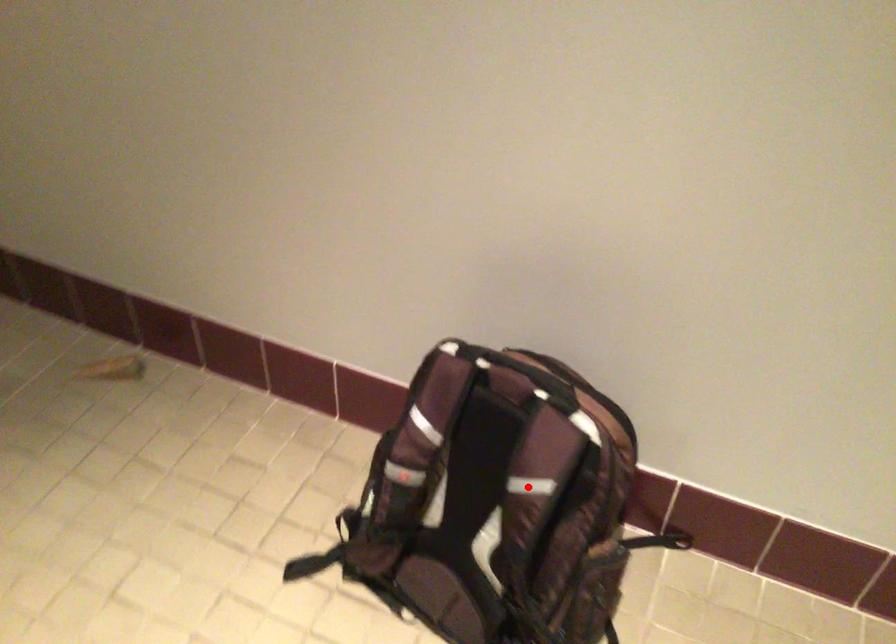
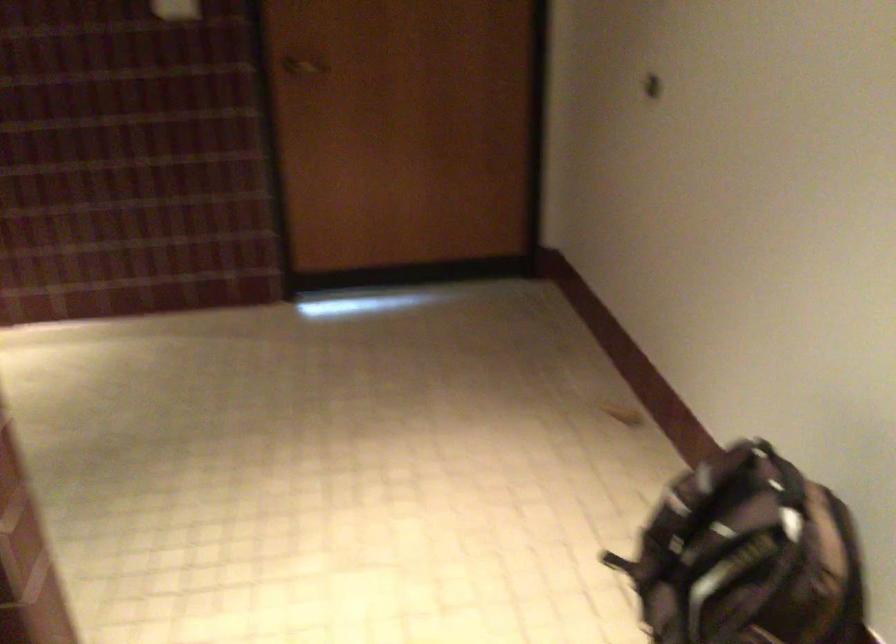
Question: I am providing you with two images of the same scene from different viewpoints. In image1, a red point is highlighted. Considering the same 3D point in image2, which of the following is correct?

Choices:
 (A) It is closer
 (B) It is farther

Answer: (B)